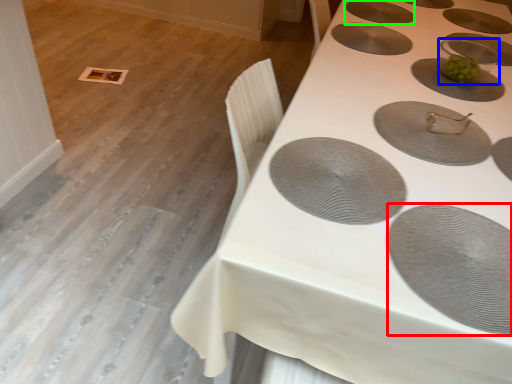
Question: Considering the real-world distances, which object is farthest from oval (highlighted by a red box)? appliance (highlighted by a blue box) or oval (highlighted by a green box)?

Choices:
 (A) appliance
 (B) oval

Answer: (B)